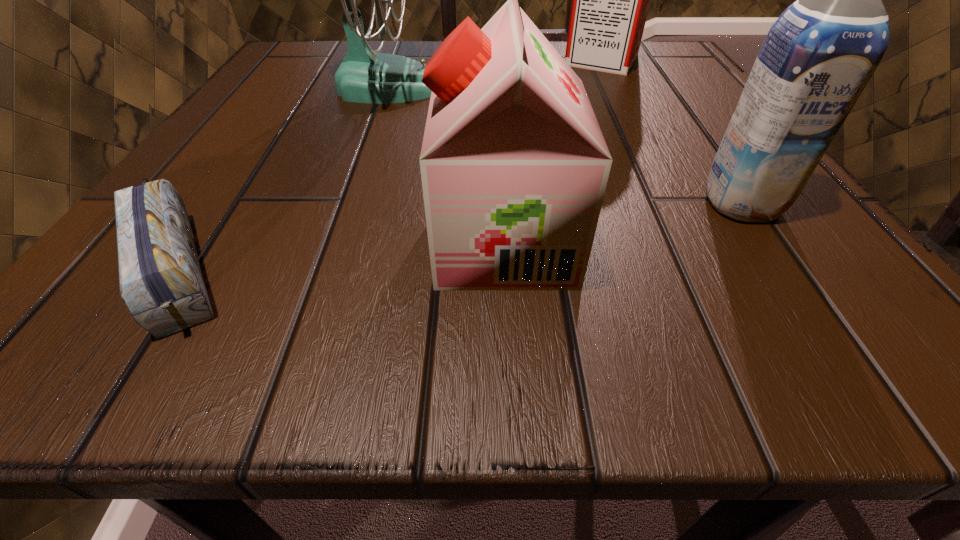
Find the location of a particular element. free space located 0.170m on the right of the pencil box is located at coordinates (418, 261).

This screenshot has height=540, width=960. I want to click on fan positioned at the far edge, so click(364, 76).

Locate an element on the screen. This screenshot has width=960, height=540. soya milk present at the far edge is located at coordinates (610, 0).

Where is `soya milk that is at the near edge`? The image size is (960, 540). soya milk that is at the near edge is located at coordinates (514, 166).

The width and height of the screenshot is (960, 540). I want to click on pencil box present at the near edge, so click(x=160, y=279).

Where is `fan present at the left edge`? Image resolution: width=960 pixels, height=540 pixels. fan present at the left edge is located at coordinates (364, 76).

The width and height of the screenshot is (960, 540). What are the coordinates of `pencil box at the left edge` in the screenshot? It's located at (160, 279).

Locate an element on the screen. Image resolution: width=960 pixels, height=540 pixels. object that is at the far left corner is located at coordinates (364, 76).

Locate an element on the screen. object that is at the near left corner is located at coordinates (160, 279).

Locate an element on the screen. The width and height of the screenshot is (960, 540). object located in the far right corner section of the desktop is located at coordinates (610, 0).